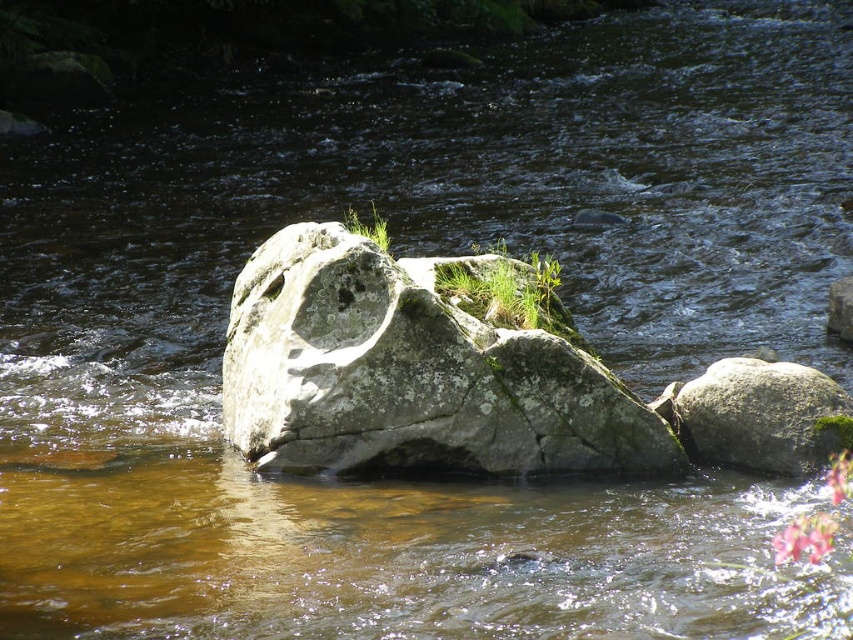
You are a hiker carrying a heavy backpack and need to cross the river. You see two gray rough rocks in the river, one at the center and one at the right. Can you safely step from the gray rough rock at center to the gray rough rock at right if your maximum jumping distance is 4 feet?

The gray rough rock at center and gray rough rock at right are 4.24 feet apart from each other. Since your maximum jumping distance is 4 feet, you cannot safely make the jump between them as the distance exceeds your capability.

You are standing at the edge of the river and want to take a photo of the gray rough rock at center. If your camera has a maximum focus range of 25 feet, will it be able to focus on the rock?

The gray rough rock at center is 24.38 feet away from the camera, which is within the maximum focus range of 25 feet. Therefore, the camera can focus on the gray rough rock at center.